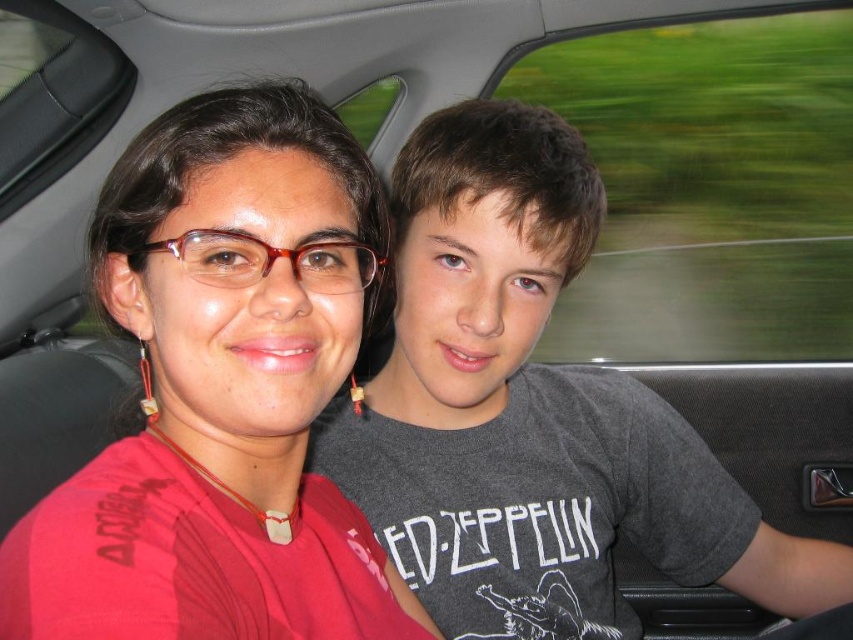
Image resolution: width=853 pixels, height=640 pixels. What do you see at coordinates (222, 392) in the screenshot?
I see `matte red glasses at center` at bounding box center [222, 392].

Can you confirm if matte red glasses at center is shorter than transparent glass window at upper right?

Yes.

Locate an element on the screen. The height and width of the screenshot is (640, 853). matte red glasses at center is located at coordinates (222, 392).

Is transparent glass window at upper right wider than transparent glass car window at upper left?

Yes, transparent glass window at upper right is wider than transparent glass car window at upper left.

Measure the distance from transparent glass window at upper right to transparent glass car window at upper left.

transparent glass window at upper right and transparent glass car window at upper left are 7.79 feet apart.

Is point (775, 102) less distant than point (74, 131)?

That is False.

The image size is (853, 640). I want to click on transparent glass window at upper right, so click(709, 188).

Which is more to the left, matte red glasses at center or transparent glass car window at upper left?

Positioned to the left is transparent glass car window at upper left.

Can you confirm if matte red glasses at center is taller than transparent glass car window at upper left?

Indeed, matte red glasses at center has a greater height compared to transparent glass car window at upper left.

Who is more forward, (190,323) or (41,116)?

Point (190,323) is in front.

Locate an element on the screen. The width and height of the screenshot is (853, 640). matte red glasses at center is located at coordinates (222, 392).